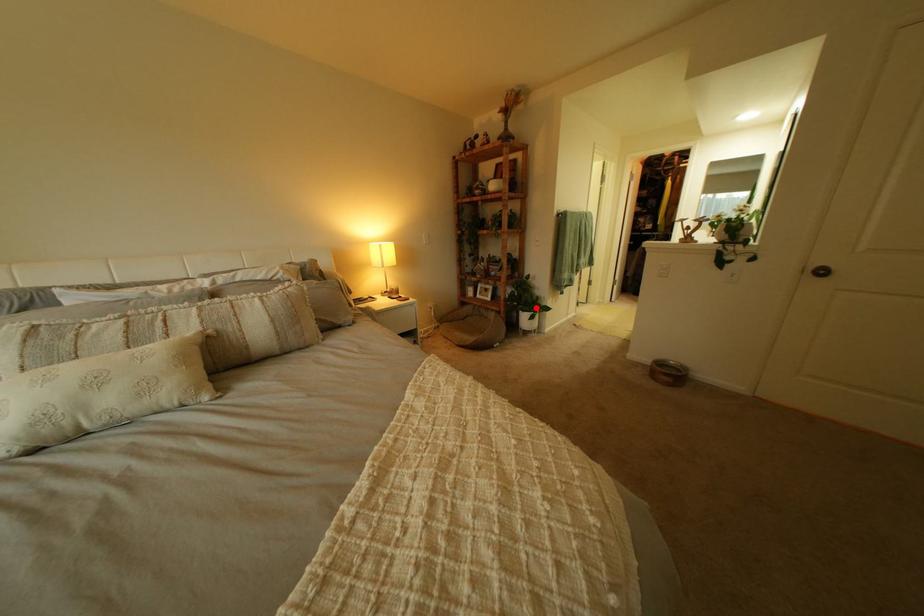
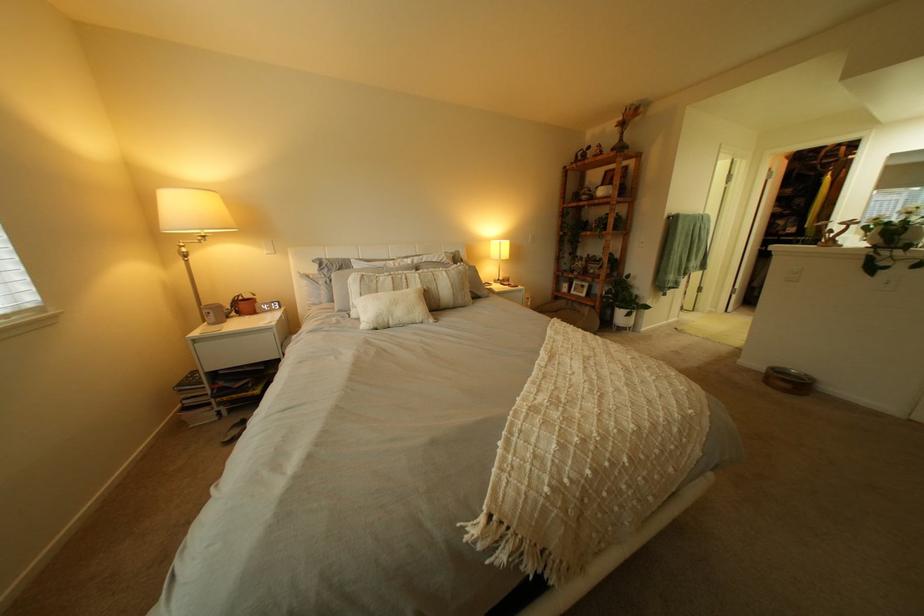
Question: A red point is marked in image1. In image2, is the corresponding 3D point closer to the camera or farther? Reply with the corresponding letter.

Choices:
 (A) The corresponding 3D point is closer.
 (B) The corresponding 3D point is farther.

Answer: (A)